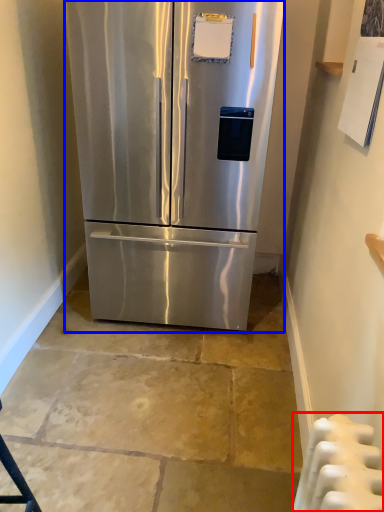
Question: Which of the following is the farthest to the observer, radiator (highlighted by a red box) or refrigerator (highlighted by a blue box)?

Choices:
 (A) radiator
 (B) refrigerator

Answer: (B)